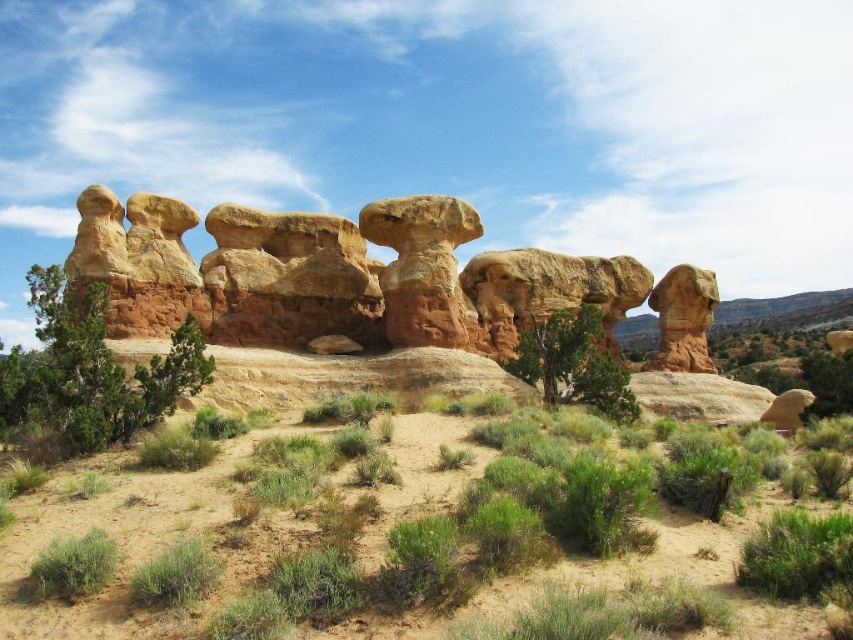
You are a hiker who wants to take a photo of the rustic sandstone rock formation at center and the green shrub at left. Which object should you focus on first if you want to capture both in a single frame without moving the camera?

The rustic sandstone rock formation at center is bigger than the green shrub at left, so you should focus on the rustic sandstone rock formation at center first to ensure it fills the frame appropriately before adjusting for the smaller green shrub at left.

You are a hiker navigating the desert landscape and need to locate the green shrub at left. Based on the scene, where would you find it relative to the dull orange rock formation at center?

The green shrub at left is located above the dull orange rock formation at center.